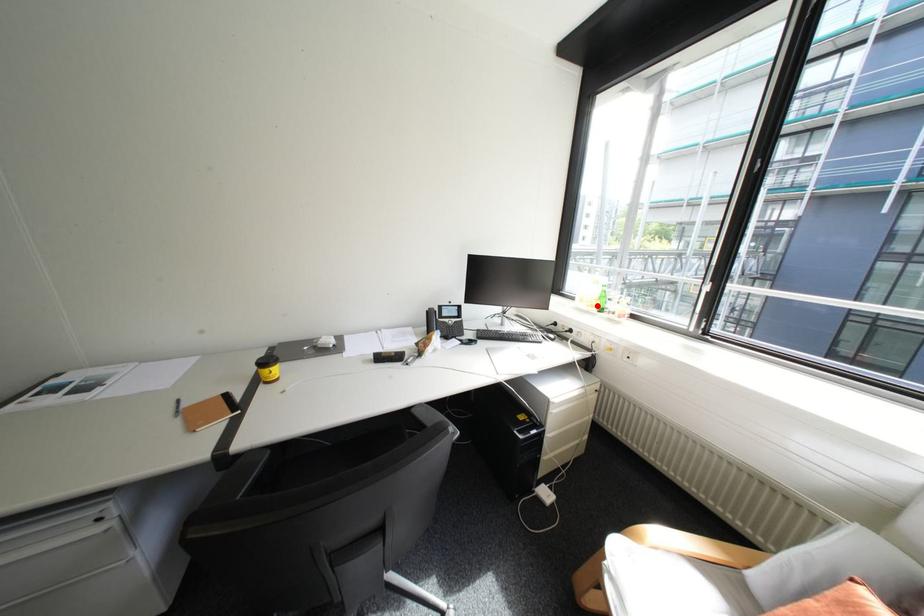
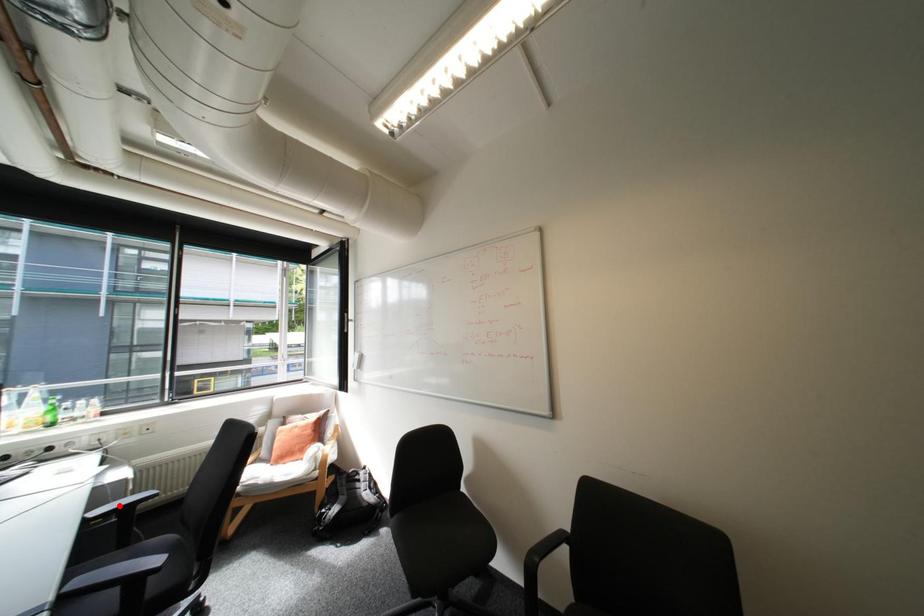
I am providing you with two images of the same scene from different viewpoints. A red point is marked on the first image and another point is marked on the second image. Do the highlighted points in image1 and image2 indicate the same real-world spot?

No